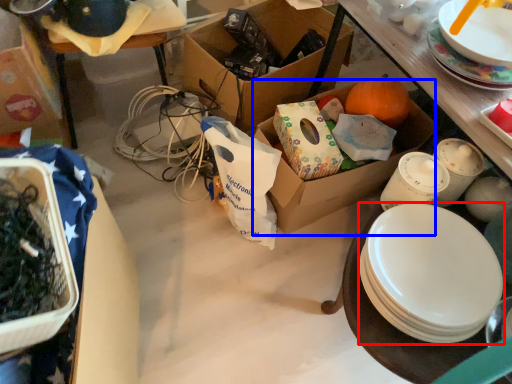
Question: Which object appears closest to the camera in this image, plate (highlighted by a red box) or box (highlighted by a blue box)?

Choices:
 (A) plate
 (B) box

Answer: (A)